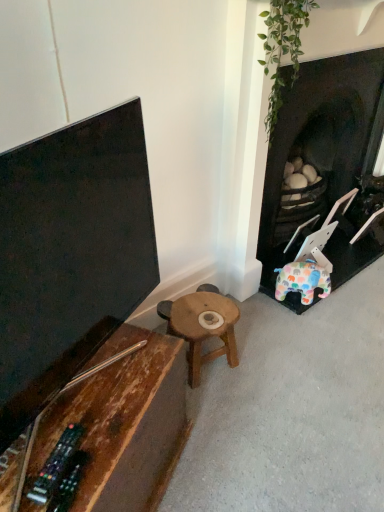
Question: Considering the positions of wooden stool at center, the 2th table viewed from the front, and dark brown wood fireplace at right in the image, is wooden stool at center, the 2th table viewed from the front, bigger or smaller than dark brown wood fireplace at right?

Choices:
 (A) small
 (B) big

Answer: (A)

Question: From a real-world perspective, is wooden stool at center, the 2th table viewed from the front, physically located above or below dark brown wood fireplace at right?

Choices:
 (A) below
 (B) above

Answer: (A)

Question: Estimate the real-world distances between objects in this image. Which object is closer to the rustic wood table at lower left, marked as the 2th table in a back-to-front arrangement?

Choices:
 (A) wooden stool at center, the 2th table viewed from the front
 (B) dark brown wood fireplace at right

Answer: (A)

Question: Estimate the real-world distances between objects in this image. Which object is farther from the dark brown wood fireplace at right?

Choices:
 (A) rustic wood table at lower left, the first table in the front-to-back sequence
 (B) wooden stool at center, the 1th table viewed from the back

Answer: (A)